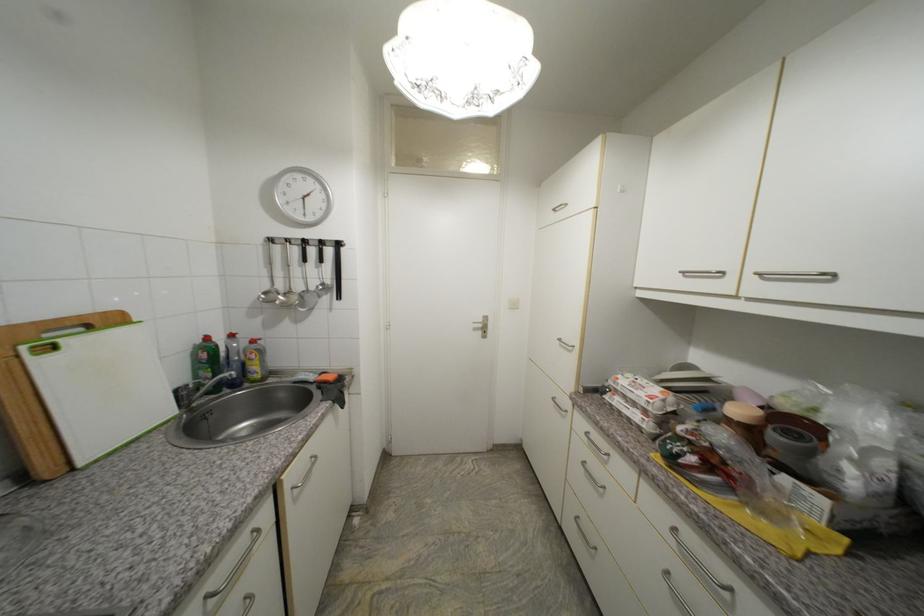
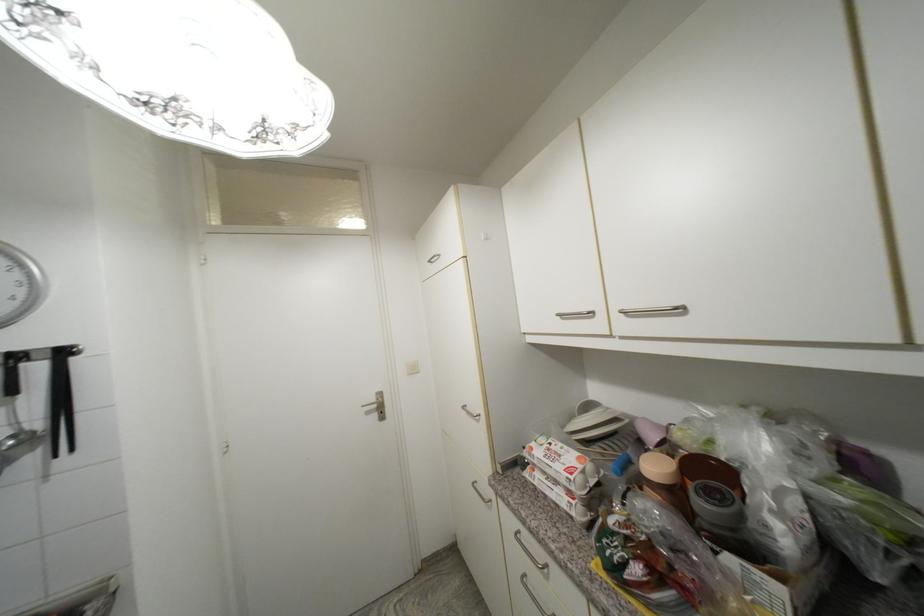
Locate, in the second image, the point that corresponds to [619,405] in the first image.

(541, 485)